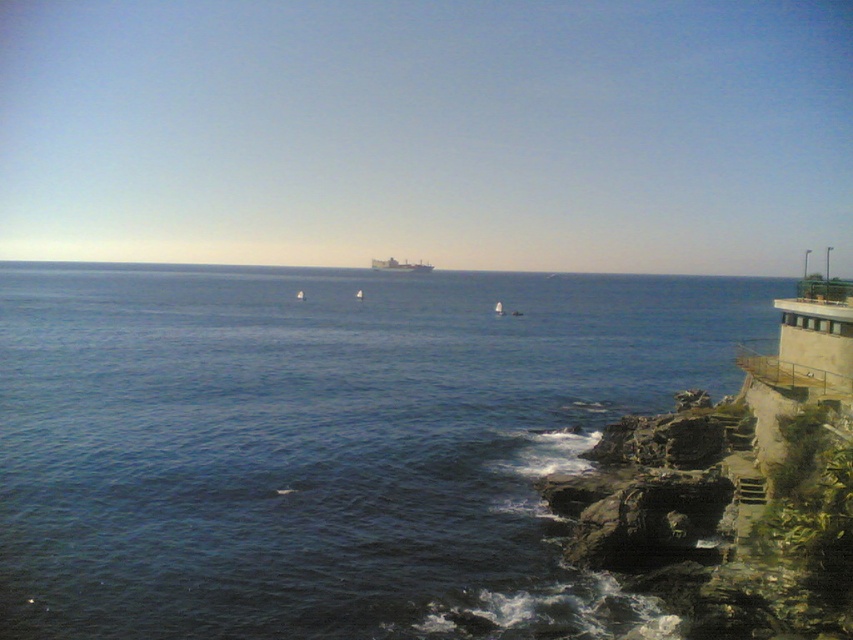
How much distance is there between blue water at lower left and metallic gray ship at center?

A distance of 168.95 meters exists between blue water at lower left and metallic gray ship at center.

Can you confirm if blue water at lower left is smaller than metallic gray ship at center?

No, blue water at lower left is not smaller than metallic gray ship at center.

Is point (271, 396) positioned behind point (380, 262)?

No, it is not.

This screenshot has width=853, height=640. I want to click on blue water at lower left, so click(326, 444).